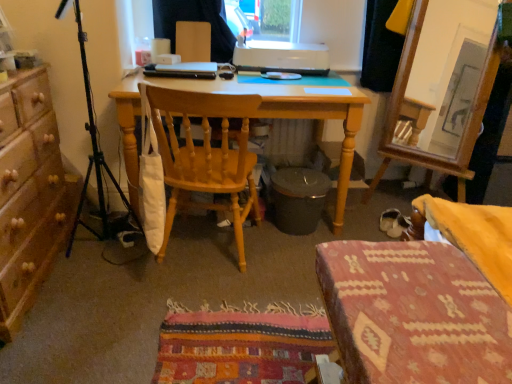
Question: Is white plastic printer at upper center smaller than black matte tripod at left?

Choices:
 (A) yes
 (B) no

Answer: (A)

Question: From a real-world perspective, is white plastic printer at upper center beneath black matte tripod at left?

Choices:
 (A) no
 (B) yes

Answer: (A)

Question: Is white plastic printer at upper center closer to camera compared to black matte tripod at left?

Choices:
 (A) no
 (B) yes

Answer: (A)

Question: Is white plastic printer at upper center positioned beyond the bounds of black matte tripod at left?

Choices:
 (A) no
 (B) yes

Answer: (B)

Question: From the image's perspective, is white plastic printer at upper center below black matte tripod at left?

Choices:
 (A) no
 (B) yes

Answer: (A)

Question: Is white plastic printer at upper center to the left of black matte tripod at left from the viewer's perspective?

Choices:
 (A) no
 (B) yes

Answer: (A)

Question: Is the position of light wood desk at center less distant than that of textured woolen stool at lower right?

Choices:
 (A) yes
 (B) no

Answer: (B)

Question: Is the position of light wood desk at center more distant than that of textured woolen stool at lower right?

Choices:
 (A) yes
 (B) no

Answer: (A)

Question: Is light wood desk at center completely or partially outside of textured woolen stool at lower right?

Choices:
 (A) no
 (B) yes

Answer: (B)

Question: Is textured woolen stool at lower right surrounded by light wood desk at center?

Choices:
 (A) no
 (B) yes

Answer: (A)

Question: Considering the relative sizes of light wood desk at center and textured woolen stool at lower right in the image provided, is light wood desk at center thinner than textured woolen stool at lower right?

Choices:
 (A) yes
 (B) no

Answer: (B)

Question: Is light wood desk at center wider than textured woolen stool at lower right?

Choices:
 (A) no
 (B) yes

Answer: (B)

Question: Is wooden chair at center to the left of white suede shoe at lower right from the viewer's perspective?

Choices:
 (A) yes
 (B) no

Answer: (A)